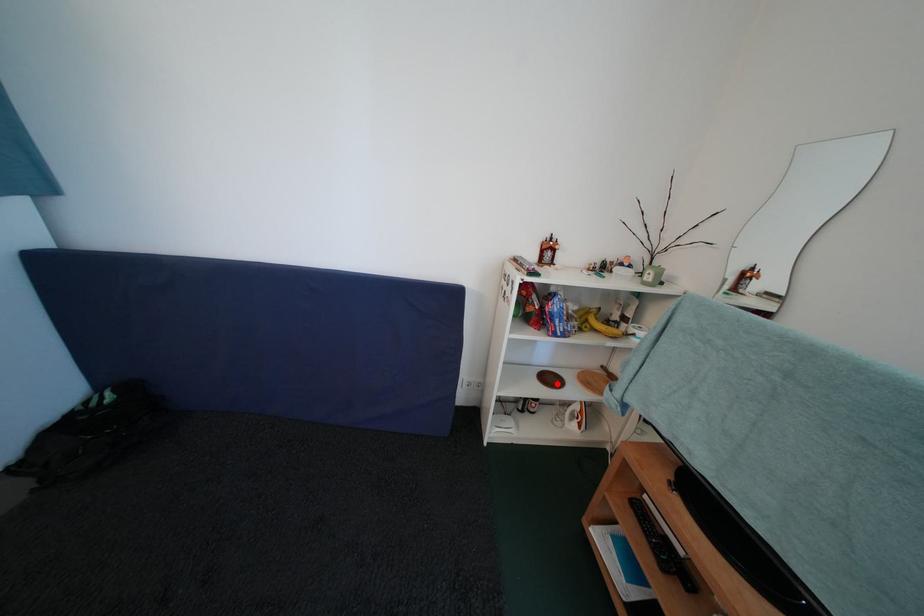
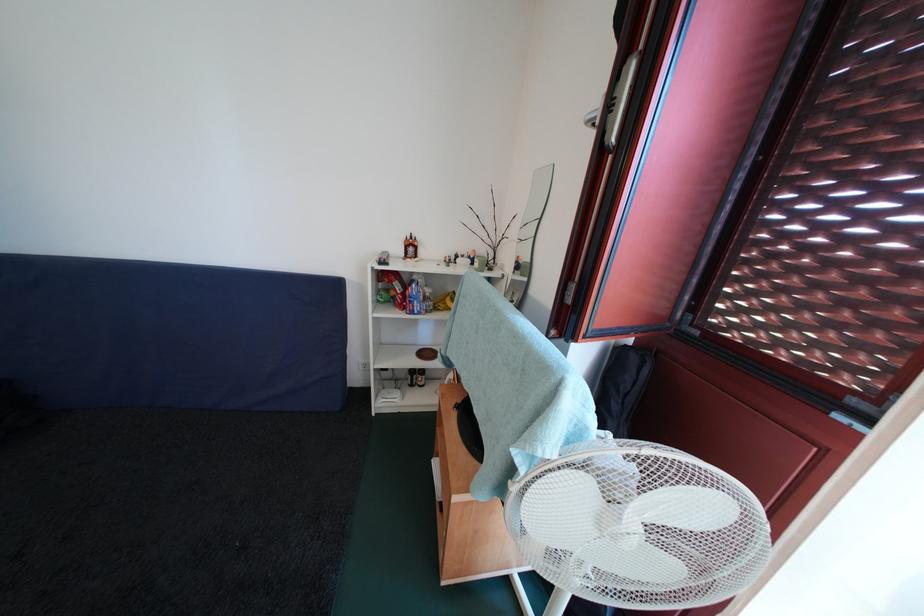
Question: I am providing you with two images of the same scene from different viewpoints. Given a red point in image1, look at the same physical point in image2. Is it:

Choices:
 (A) Closer to the viewpoint
 (B) Farther from the viewpoint

Answer: (B)